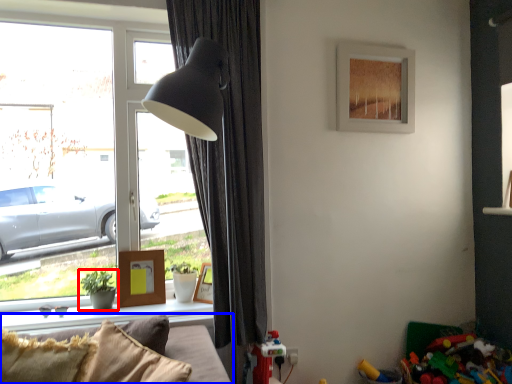
Question: Which object appears farthest to the camera in this image, houseplant (highlighted by a red box) or studio couch (highlighted by a blue box)?

Choices:
 (A) houseplant
 (B) studio couch

Answer: (A)